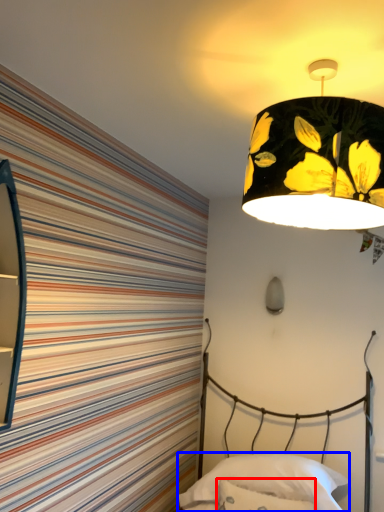
Question: Which object appears closest to the camera in this image, throw pillow (highlighted by a red box) or pillow (highlighted by a blue box)?

Choices:
 (A) throw pillow
 (B) pillow

Answer: (A)